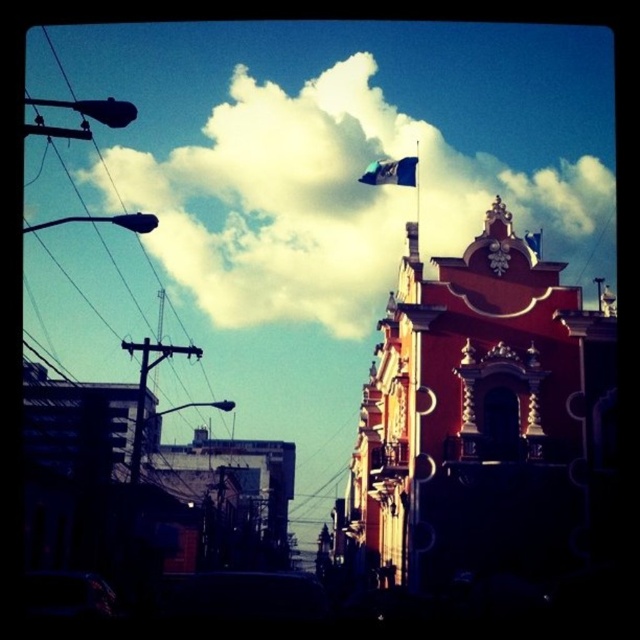
Looking at this image, who is positioned more to the right, white fluffy cloud at upper center or blue fabric flag at upper center?

blue fabric flag at upper center is more to the right.

Does white fluffy cloud at upper center appear on the left side of blue fabric flag at upper center?

Yes, white fluffy cloud at upper center is to the left of blue fabric flag at upper center.

Is point (548, 236) more distant than point (397, 182)?

Yes, it is behind point (397, 182).

Identify the location of white fluffy cloud at upper center. This screenshot has height=640, width=640. (337, 198).

Between metallic pole at left and blue fabric flag at upper center, which one has less height?

Standing shorter between the two is blue fabric flag at upper center.

Who is positioned more to the right, metallic pole at left or blue fabric flag at upper center?

From the viewer's perspective, blue fabric flag at upper center appears more on the right side.

Does point (132, 483) come closer to viewer compared to point (406, 163)?

Yes.

Locate an element on the screen. metallic pole at left is located at coordinates (138, 404).

Does white fluffy cloud at upper center have a larger size compared to metallic pole at left?

Yes.

Who is higher up, white fluffy cloud at upper center or metallic pole at left?

Result: white fluffy cloud at upper center

Who is more distant from viewer, (x=570, y=262) or (x=131, y=477)?

The point (x=570, y=262) is behind.

This screenshot has height=640, width=640. Find the location of `white fluffy cloud at upper center`. white fluffy cloud at upper center is located at coordinates (337, 198).